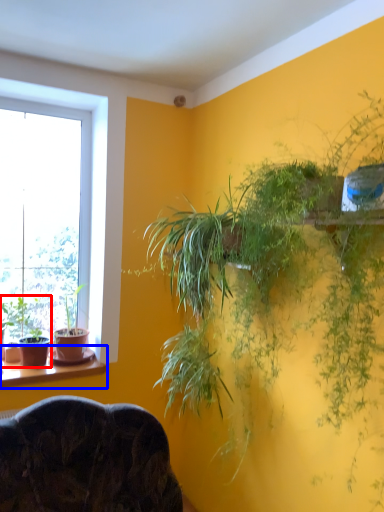
Question: Among these objects, which one is nearest to the camera, houseplant (highlighted by a red box) or window sill (highlighted by a blue box)?

Choices:
 (A) houseplant
 (B) window sill

Answer: (B)